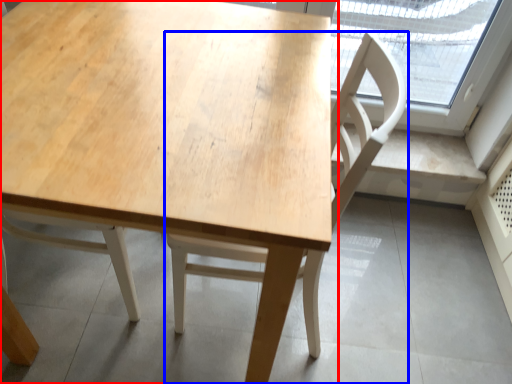
Question: Which object is further to the camera taking this photo, table (highlighted by a red box) or chair (highlighted by a blue box)?

Choices:
 (A) table
 (B) chair

Answer: (B)